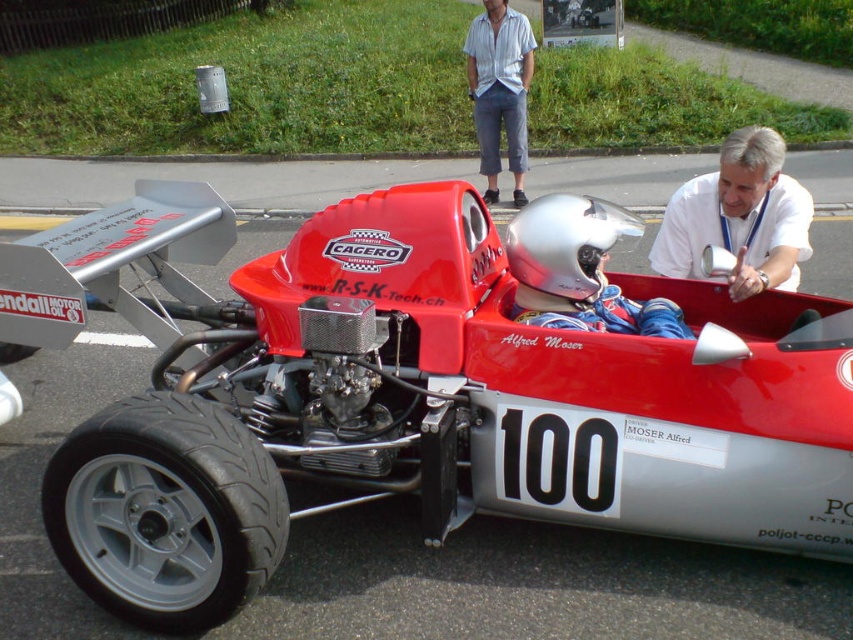
Locate an element on the screen. The height and width of the screenshot is (640, 853). white lanyard at upper center is located at coordinates (740, 218).

Consider the image. Between white lanyard at upper center and light blue cotton shirt at upper center, which one appears on the right side from the viewer's perspective?

white lanyard at upper center

This screenshot has height=640, width=853. In order to click on white lanyard at upper center in this screenshot , I will do `click(740, 218)`.

Which of these two, shiny red race car at center or light blue cotton shirt at upper center, stands shorter?

Standing shorter between the two is shiny red race car at center.

Which is in front, point (619, 476) or point (523, 170)?

Point (619, 476)

You are a GUI agent. You are given a task and a screenshot of the screen. Output one action in this format:
    pyautogui.click(x=<x>, y=<y>)
    Task: Click on the shiny red race car at center
    
    Given the screenshot: What is the action you would take?
    pyautogui.click(x=410, y=397)

Looking at this image, can you confirm if shiny red race car at center is wider than silver metallic helmet at center?

Indeed, shiny red race car at center has a greater width compared to silver metallic helmet at center.

Does point (161, 408) lie in front of point (624, 228)?

That is True.

I want to click on shiny red race car at center, so click(x=410, y=397).